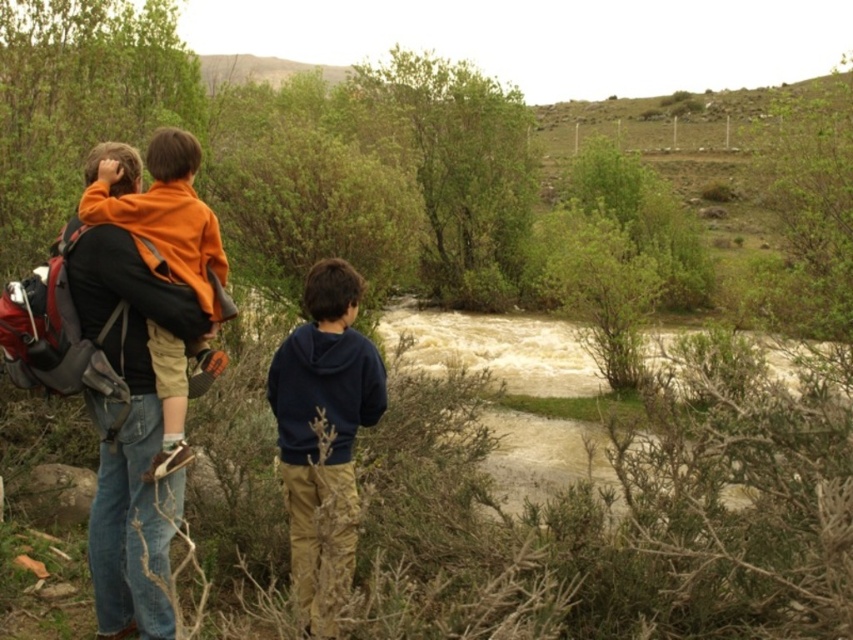
Question: Which point is farther to the camera?

Choices:
 (A) orange fleece jacket at left
 (B) navy blue hoodie at center

Answer: (A)

Question: Which point is farther to the camera?

Choices:
 (A) (206, 355)
 (B) (346, 552)

Answer: (A)

Question: Does navy blue hoodie at center have a smaller size compared to orange fleece jacket at left?

Choices:
 (A) yes
 (B) no

Answer: (B)

Question: Is navy blue hoodie at center positioned in front of orange fleece jacket at left?

Choices:
 (A) yes
 (B) no

Answer: (A)

Question: Observing the image, what is the correct spatial positioning of navy blue hoodie at center in reference to orange fleece jacket at left?

Choices:
 (A) above
 (B) below

Answer: (B)